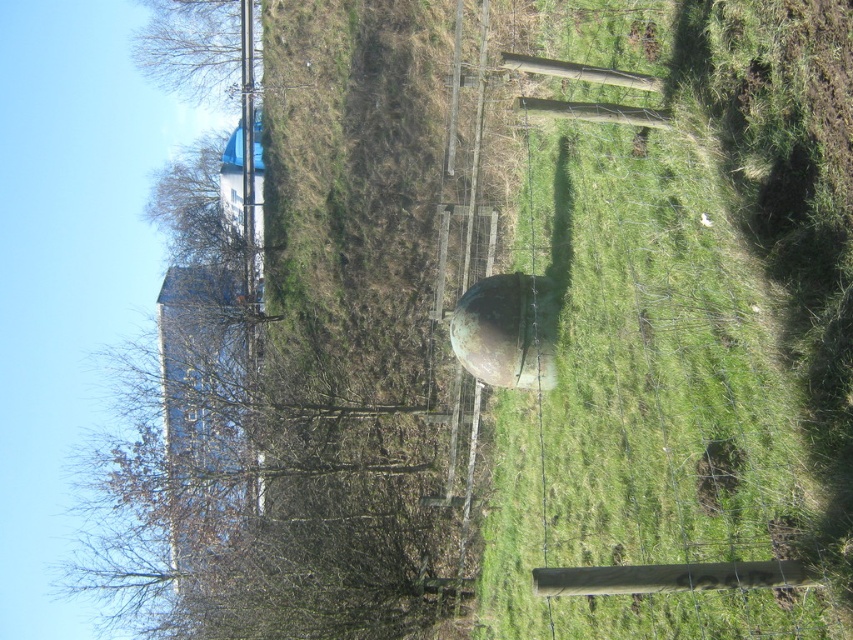
Does green grassy field at center come behind green matte water tower at center?

That is False.

Is green grassy field at center shorter than green matte water tower at center?

No.

Does point (669, 131) come in front of point (518, 372)?

Yes, it is in front of point (518, 372).

Where is `green grassy field at center`? green grassy field at center is located at coordinates (688, 328).